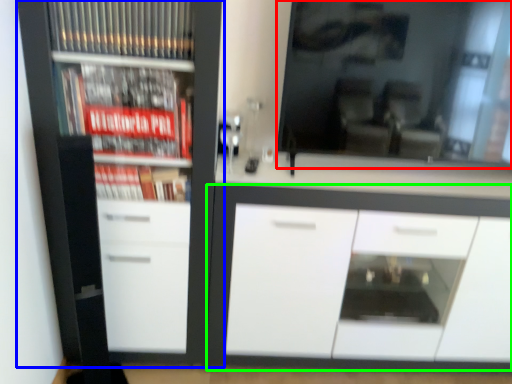
Question: Estimate the real-world distances between objects in this image. Which object is closer to mirror (highlighted by a red box), cupboard (highlighted by a blue box) or cabinetry (highlighted by a green box)?

Choices:
 (A) cupboard
 (B) cabinetry

Answer: (B)